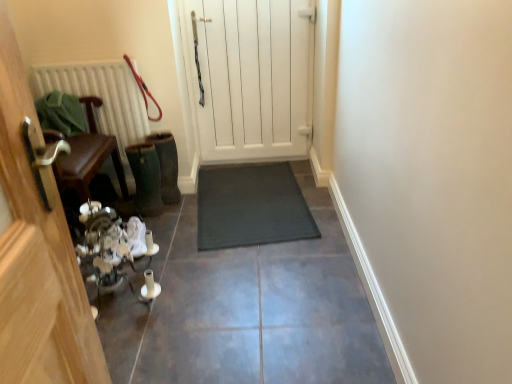
In order to face white wooden door at center, arranged as the 1th door when viewed from the right, should I rotate leftwards or rightwards?

It's best to rotate left around 0.781 degrees.

Locate an element on the screen. dark gray rubber mat at center is located at coordinates (257, 307).

What do you see at coordinates (251, 206) in the screenshot? I see `dark gray rubber mat at center` at bounding box center [251, 206].

Identify the location of white wooden door at center, marked as the 2th door in a left-to-right arrangement. (250, 76).

Is dark gray rubber mat at center completely or partially inside dark gray rubber mat at center?

Yes, dark gray rubber mat at center is inside dark gray rubber mat at center.

In terms of width, does dark gray rubber mat at center look wider or thinner when compared to dark gray rubber mat at center?

Considering their sizes, dark gray rubber mat at center looks broader than dark gray rubber mat at center.

Based on their sizes in the image, would you say dark gray rubber mat at center is bigger or smaller than dark gray rubber mat at center?

Clearly, dark gray rubber mat at center is larger in size than dark gray rubber mat at center.

Based on their positions, is dark gray rubber mat at center located to the left or right of dark gray rubber mat at center?

In the image, dark gray rubber mat at center appears on the left side of dark gray rubber mat at center.

Could you tell me if dark gray rubber mat at center is facing white textured radiator at left?

No, dark gray rubber mat at center is not turned towards white textured radiator at left.

How many degrees apart are the facing directions of dark gray rubber mat at center and white textured radiator at left?

dark gray rubber mat at center and white textured radiator at left are facing 0.00159 degrees away from each other.

Is the depth of dark gray rubber mat at center less than that of white textured radiator at left?

Yes, dark gray rubber mat at center is in front of white textured radiator at left.

Can we say dark gray rubber mat at center lies outside white textured radiator at left?

That's correct, dark gray rubber mat at center is outside of white textured radiator at left.

How distant is dark gray rubber mat at center from wooden chair at left, which is the second door from back to front?

dark gray rubber mat at center and wooden chair at left, which is the second door from back to front, are 4.82 feet apart from each other.

Can you see dark gray rubber mat at center touching wooden chair at left, the second door from the right?

No, dark gray rubber mat at center is not in contact with wooden chair at left, the second door from the right.

Based on the photo, what's the angular difference between dark gray rubber mat at center and wooden chair at left, which is the second door from back to front,'s facing directions?

There is a 83.8-degree angle between the facing directions of dark gray rubber mat at center and wooden chair at left, which is the second door from back to front.

Consider the image. From the image's perspective, is dark gray rubber mat at center above or below wooden chair at left, the second door from the right?

dark gray rubber mat at center is below wooden chair at left, the second door from the right.

From the image's perspective, would you say wooden chair at left, which is the first door in left-to-right order, is shown under dark gray rubber mat at center?

No, from the image's perspective, wooden chair at left, which is the first door in left-to-right order, is not beneath dark gray rubber mat at center.

You are a GUI agent. You are given a task and a screenshot of the screen. Output one action in this format:
    pyautogui.click(x=<x>, y=<y>)
    Task: Click on the path below the wooden chair at left, acting as the first door starting from the front (from the image's perspective)
    
    Given the screenshot: What is the action you would take?
    pyautogui.click(x=257, y=307)

Would you say wooden chair at left, which is the first door in left-to-right order, is outside dark gray rubber mat at center?

That's correct, wooden chair at left, which is the first door in left-to-right order, is outside of dark gray rubber mat at center.

Is wooden chair at left, the second door from the right, not close to dark gray rubber mat at center?

They are positioned close to each other.

From the image's perspective, which one is positioned higher, red leather leash at upper left or white textured radiator at left?

From the image's view, red leather leash at upper left is above.

Which is nearer, (149, 119) or (37, 66)?

The point (37, 66) is closer to the camera.

Looking at the image, does red leather leash at upper left seem bigger or smaller compared to white textured radiator at left?

Clearly, red leather leash at upper left is smaller in size than white textured radiator at left.

Is white textured radiator at left surrounding red leather leash at upper left?

No.

Which is farther, (x=104, y=72) or (x=132, y=65)?

The point (x=132, y=65) is behind.

Who is shorter, white textured radiator at left or red leather leash at upper left?

red leather leash at upper left.

Image resolution: width=512 pixels, height=384 pixels. I want to click on radiator behind the red leather leash at upper left, so click(x=101, y=96).

Do you think dark gray rubber mat at center is within dark gray rubber mat at center, or outside of it?

dark gray rubber mat at center fits inside dark gray rubber mat at center.

Which of these two, dark gray rubber mat at center or dark gray rubber mat at center, is bigger?

Bigger between the two is dark gray rubber mat at center.

Between dark gray rubber mat at center and dark gray rubber mat at center, which one is positioned behind?

dark gray rubber mat at center is behind.

Is dark gray rubber mat at center taller than dark gray rubber mat at center?

Indeed, dark gray rubber mat at center has a greater height compared to dark gray rubber mat at center.

Where is `path lying in front of the dark gray rubber mat at center`? This screenshot has width=512, height=384. path lying in front of the dark gray rubber mat at center is located at coordinates (257, 307).

What are the coordinates of `radiator above the dark gray rubber mat at center (from the image's perspective)` in the screenshot? It's located at (101, 96).

Based on their spatial positions, is white textured radiator at left or white wooden door at center, marked as the 2th door in a left-to-right arrangement, further from dark gray rubber mat at center?

white textured radiator at left is positioned further to the anchor dark gray rubber mat at center.

Estimate the real-world distances between objects in this image. Which object is closer to white wooden door at center, which appears as the second door when viewed from the front, wooden chair at left, which is the first door in left-to-right order, or dark gray rubber mat at center?

dark gray rubber mat at center.

From the image, which object appears to be farther from dark gray rubber mat at center, dark gray rubber mat at center or white wooden door at center, positioned as the first door in back-to-front order?

The object further to dark gray rubber mat at center is white wooden door at center, positioned as the first door in back-to-front order.

Based on their spatial positions, is wooden chair at left, acting as the first door starting from the front, or dark gray rubber mat at center further from red leather leash at upper left?

wooden chair at left, acting as the first door starting from the front, is further to red leather leash at upper left.

Which object lies further to the anchor point dark gray rubber mat at center, white wooden door at center, arranged as the 1th door when viewed from the right, or red leather leash at upper left?

Based on the image, white wooden door at center, arranged as the 1th door when viewed from the right, appears to be further to dark gray rubber mat at center.

Estimate the real-world distances between objects in this image. Which object is further from red leather leash at upper left, dark gray rubber mat at center or white textured radiator at left?

dark gray rubber mat at center is further to red leather leash at upper left.

Based on their spatial positions, is red leather leash at upper left or wooden chair at left, which is the first door in left-to-right order, closer to dark gray rubber mat at center?

red leather leash at upper left lies closer to dark gray rubber mat at center than the other object.

Which object lies further to the anchor point red leather leash at upper left, dark gray rubber mat at center or wooden chair at left, which is the first door in left-to-right order?

Among the two, wooden chair at left, which is the first door in left-to-right order, is located further to red leather leash at upper left.

At what (x,y) coordinates should I click in order to perform the action: click on leash located between dark gray rubber mat at center and white textured radiator at left in the depth direction. Please return your answer as a coordinate pair (x, y). The image size is (512, 384). Looking at the image, I should click on (144, 91).

The width and height of the screenshot is (512, 384). Find the location of `leash located between wooden chair at left, the second door from the right, and dark gray rubber mat at center in the left-right direction`. leash located between wooden chair at left, the second door from the right, and dark gray rubber mat at center in the left-right direction is located at coordinates (144, 91).

You are a GUI agent. You are given a task and a screenshot of the screen. Output one action in this format:
    pyautogui.click(x=<x>, y=<y>)
    Task: Click on the radiator between wooden chair at left, which is the first door in left-to-right order, and dark gray rubber mat at center from left to right
    This screenshot has width=512, height=384.
    Given the screenshot: What is the action you would take?
    pyautogui.click(x=101, y=96)

Where is `leash between wooden chair at left, which is the second door from back to front, and white wooden door at center, marked as the 2th door in a left-to-right arrangement, in the horizontal direction`? leash between wooden chair at left, which is the second door from back to front, and white wooden door at center, marked as the 2th door in a left-to-right arrangement, in the horizontal direction is located at coordinates (144, 91).